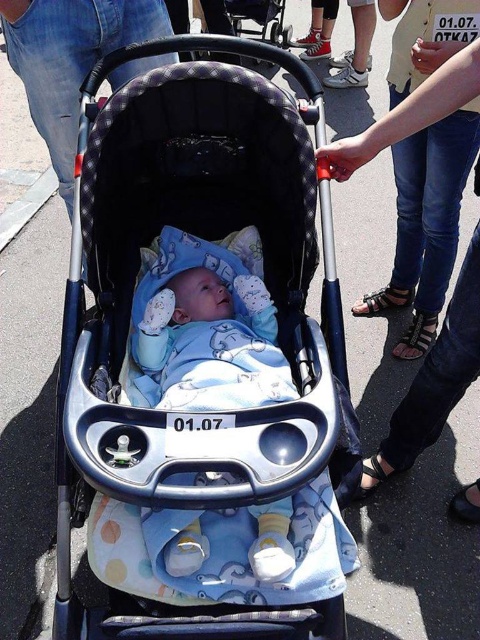
You are a photographer standing at a certain distance from the matte blue fabric baby carriage at center. You want to take a photo that captures the entire carriage in the frame without any distortion. Considering the camera you are using has a minimum focusing distance of 1.2 meters, will you be able to take the photo as planned?

The matte blue fabric baby carriage at center is 1.06 meters away from the camera. Since the minimum focusing distance of the camera is 1.2 meters, the camera cannot focus properly at 1.06 meters. Therefore, you will not be able to take the photo as planned without distortion.

You are a parent holding a small toy that is 15 cm tall. You want to place it on top of the matte blue fabric baby carriage at center so the baby can see it. Is the blue soft fabric baby at center able to see the toy if you place it there?

The matte blue fabric baby carriage at center is much taller than the blue soft fabric baby at center. Since the toy is placed on top of the carriage, the baby may not be able to see it due to the height difference.

You are a parent trying to place a small toy on the matte blue fabric baby carriage at center. Based on the coordinates provided, where should you place the toy to ensure it stays centered?

The toy should be placed at the coordinates point (x=130, y=314) to ensure it stays centered on the matte blue fabric baby carriage at center.